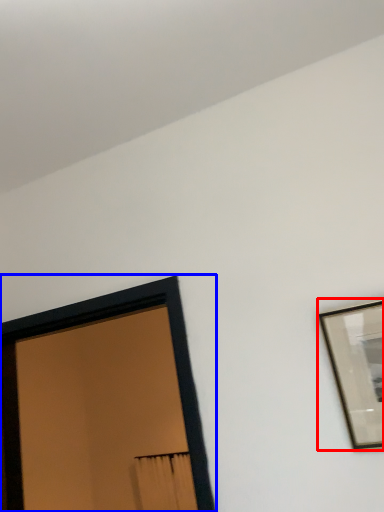
Question: Which of the following is the closest to the observer, picture frame (highlighted by a red box) or picture frame (highlighted by a blue box)?

Choices:
 (A) picture frame
 (B) picture frame

Answer: (A)